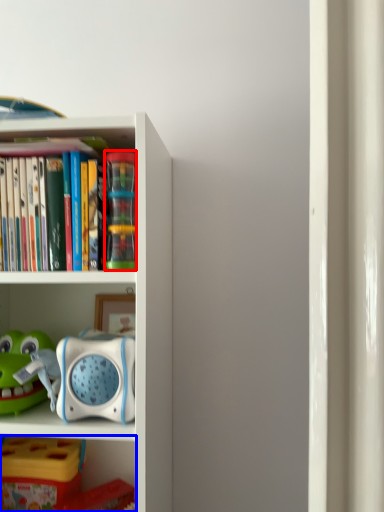
Question: Which object is closer to the camera taking this photo, toy (highlighted by a red box) or shelf (highlighted by a blue box)?

Choices:
 (A) toy
 (B) shelf

Answer: (A)